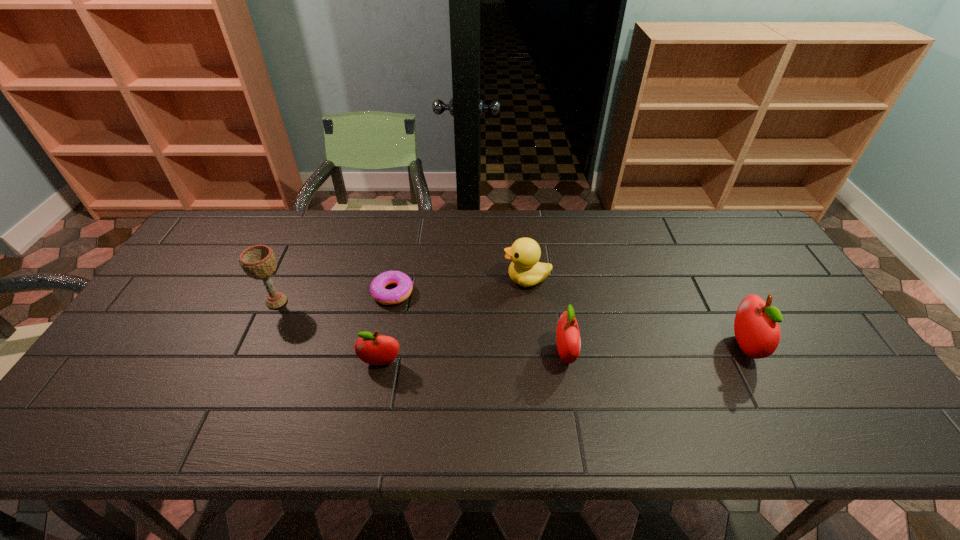
You are a GUI agent. You are given a task and a screenshot of the screen. Output one action in this format:
    pyautogui.click(x=<x>, y=<y>)
    Task: Click on the vacant region between the second shortest object and the second tallest apple
    This screenshot has width=960, height=540.
    Given the screenshot: What is the action you would take?
    pyautogui.click(x=473, y=359)

At what (x,y) coordinates should I click in order to perform the action: click on free point between the duck and the fifth tallest object. Please return your answer as a coordinate pair (x, y). The height and width of the screenshot is (540, 960). Looking at the image, I should click on (454, 321).

Identify the location of vacant area that lies between the second apple from left to right and the doughnut. (479, 323).

Find the location of a particular element. This screenshot has height=540, width=960. vacant point located between the duck and the second apple from right to left is located at coordinates (546, 316).

Locate an element on the screen. The height and width of the screenshot is (540, 960). free space between the duck and the second tallest apple is located at coordinates (546, 316).

Where is `vacant space in between the doughnut and the leftmost apple`? The height and width of the screenshot is (540, 960). vacant space in between the doughnut and the leftmost apple is located at coordinates (x=387, y=328).

Image resolution: width=960 pixels, height=540 pixels. In order to click on blank region between the second apple from right to left and the shortest object in this screenshot , I will do `click(479, 323)`.

Locate an element on the screen. The width and height of the screenshot is (960, 540). free space between the doughnut and the second shortest object is located at coordinates click(387, 328).

Identify which object is located as the second nearest to the duck. Please provide its 2D coordinates. Your answer should be formatted as a tuple, i.e. [(x, y)], where the tuple contains the x and y coordinates of a point satisfying the conditions above.

[(399, 294)]

The width and height of the screenshot is (960, 540). Find the location of `object identified as the second closest to the rightmost apple`. object identified as the second closest to the rightmost apple is located at coordinates (525, 270).